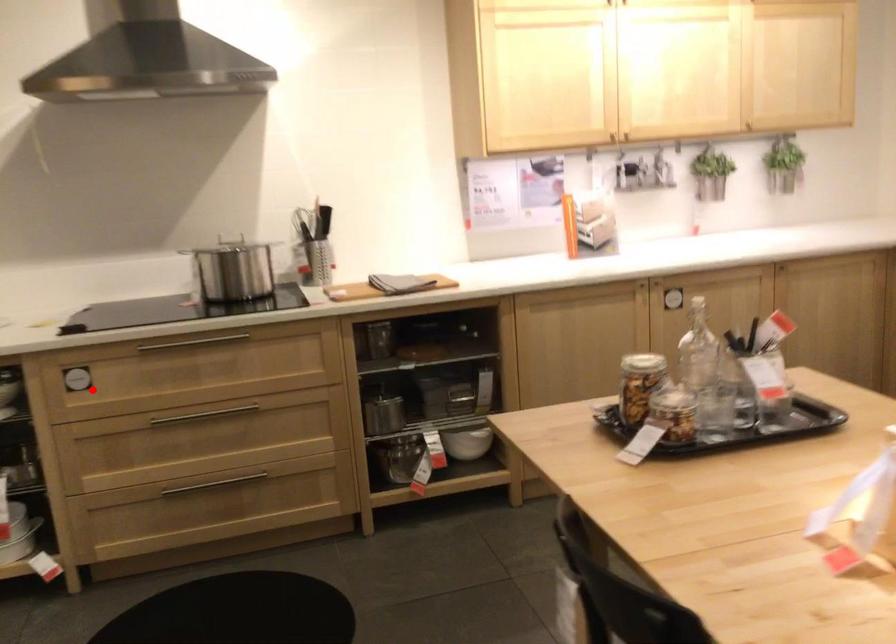
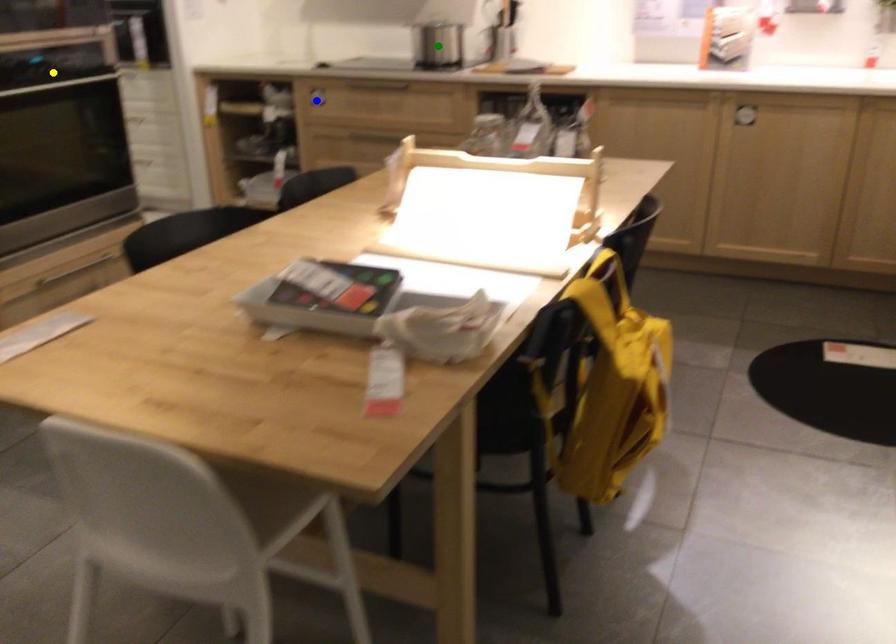
Question: I am providing you with two images of the same scene from different viewpoints. A red point is marked on the first image. You are given multiple points on the second image. Which point in image 2 represents the same 3d spot as the red point in image 1?

Choices:
 (A) yellow point
 (B) blue point
 (C) green point

Answer: (B)